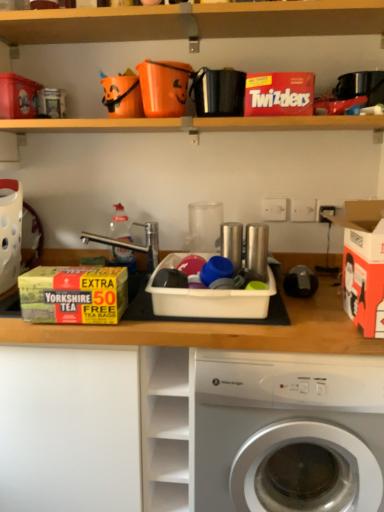
Question: Considering the positions of matte cardboard box at upper left, marked as the fifth storage box in a right-to-left arrangement, and yellow cardboard box at left, the second storage box when ordered from left to right, in the image, is matte cardboard box at upper left, marked as the fifth storage box in a right-to-left arrangement, wider or thinner than yellow cardboard box at left, the second storage box when ordered from left to right,?

Choices:
 (A) thin
 (B) wide

Answer: (B)

Question: Looking at the image, does matte cardboard box at upper left, marked as the fifth storage box in a right-to-left arrangement, seem bigger or smaller compared to yellow cardboard box at left, the second storage box when ordered from left to right?

Choices:
 (A) small
 (B) big

Answer: (A)

Question: Which of these objects is positioned farthest from the transparent plastic bottle at center?

Choices:
 (A) yellow cardboard box at left, the second storage box when ordered from left to right
 (B) red cardboard twizzlers at upper center, acting as the 4th storage box starting from the left
 (C) white cardboard box at right, the first storage box viewed from the right
 (D) white plastic container at center, arranged as the 3th storage box when viewed from the right
 (E) black leather wallet at upper center, marked as the 1th appliance in a top-to-bottom arrangement

Answer: (C)

Question: Considering the real-world distances, which object is closest to the red cardboard twizzlers at upper center, the 2th storage box positioned from the right?

Choices:
 (A) shiny metallic cup at center, arranged as the first appliance when viewed from the right
 (B) white plastic container at center, the 3th storage box when ordered from left to right
 (C) yellow cardboard box at left, which ranks as the fourth storage box in right-to-left order
 (D) white cardboard box at right, the first storage box viewed from the right
 (E) black leather wallet at upper center, the first appliance positioned from the left

Answer: (E)